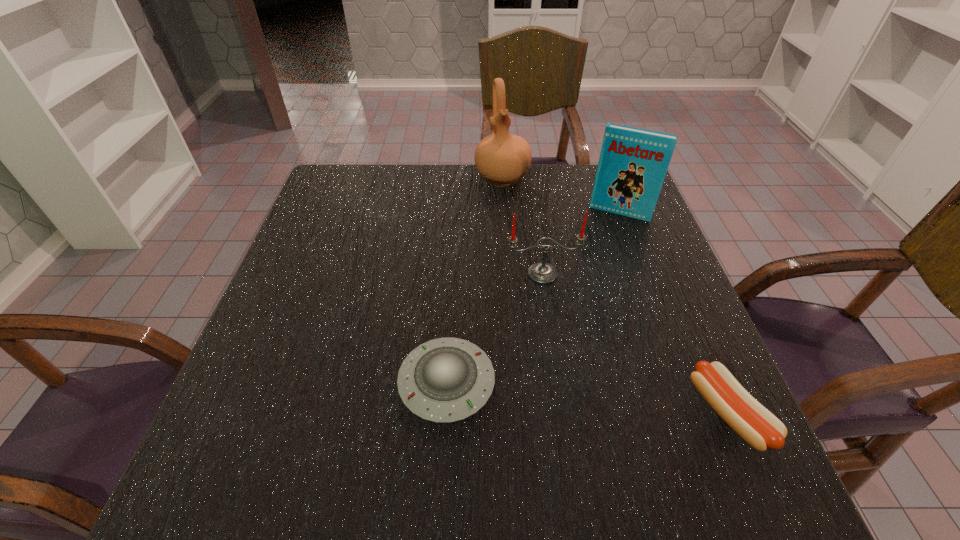
The width and height of the screenshot is (960, 540). Identify the location of unoccupied area between the third nearest object and the saucer. (494, 328).

Find the location of `free spot between the sausage and the pottery`. free spot between the sausage and the pottery is located at coordinates (x=615, y=295).

The width and height of the screenshot is (960, 540). Find the location of `blank region between the second farthest object and the farthest object`. blank region between the second farthest object and the farthest object is located at coordinates (561, 195).

Find the location of a particular element. The height and width of the screenshot is (540, 960). vacant space that's between the sausage and the candle is located at coordinates [x=636, y=343].

In order to click on free point between the saucer and the second farthest object in this screenshot , I will do `click(534, 298)`.

This screenshot has height=540, width=960. I want to click on vacant area that lies between the pottery and the saucer, so click(474, 281).

At what (x,y) coordinates should I click in order to perform the action: click on free space between the sausage and the second farthest object. Please return your answer as a coordinate pair (x, y). Image resolution: width=960 pixels, height=540 pixels. Looking at the image, I should click on (674, 313).

At what (x,y) coordinates should I click in order to perform the action: click on vacant space that's between the third farthest object and the sausage. Please return your answer as a coordinate pair (x, y). Looking at the image, I should click on (636, 343).

I want to click on the third closest object relative to the sausage, so click(633, 162).

This screenshot has width=960, height=540. Find the location of `object that stands as the fourth closest to the third farthest object`. object that stands as the fourth closest to the third farthest object is located at coordinates (502, 158).